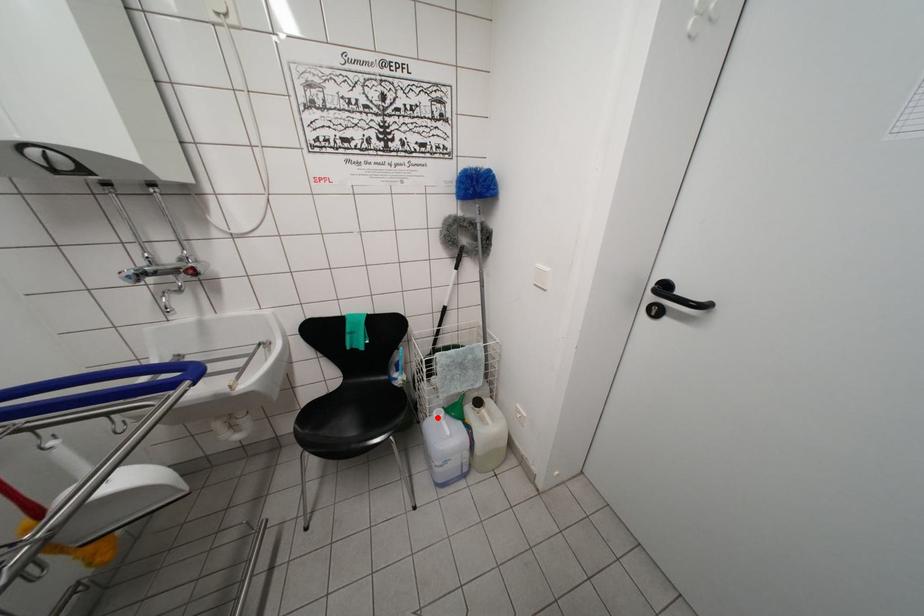
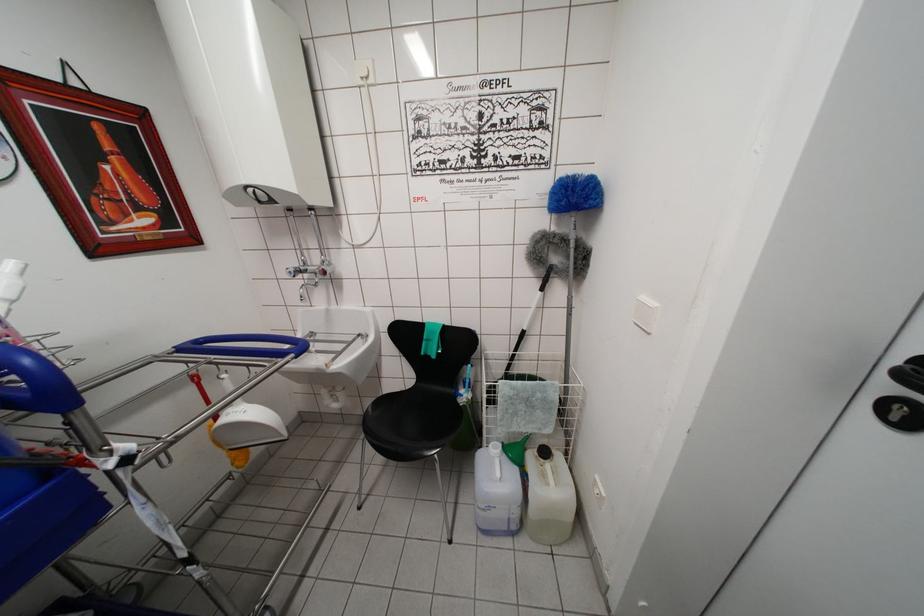
Locate, in the second image, the point that corresponds to the highlighted location in the first image.

(493, 450)